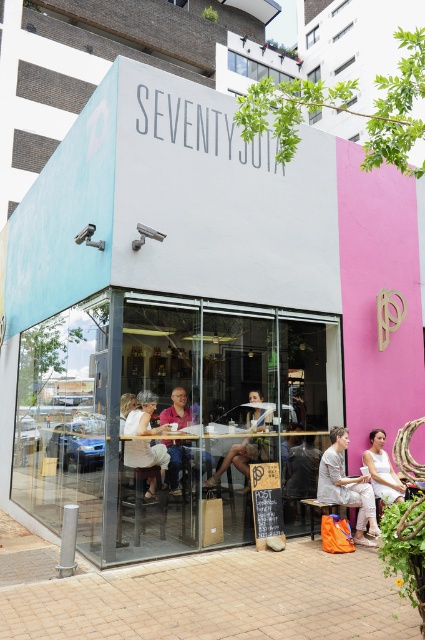
You are standing at the camera position and want to place a 1.2 meter wide banner between the wooden table at center and the camera. Is there enough space to place the banner without it overlapping with the table?

The wooden table at center and camera are 5.70 meters apart from each other. Since the banner is only 1.2 meters wide, there is sufficient space between them to place the banner without overlapping.

You are a customer sitting at the wooden table at center in the modern cafe. You want to grab a napkin that is on the white cotton dress at center. Can you reach it without moving from your seat?

The wooden table at center is to the right of the white cotton dress at center, so the dress is to the left of the table. Since you are sitting at the table, you can likely reach the dress if it is within arm